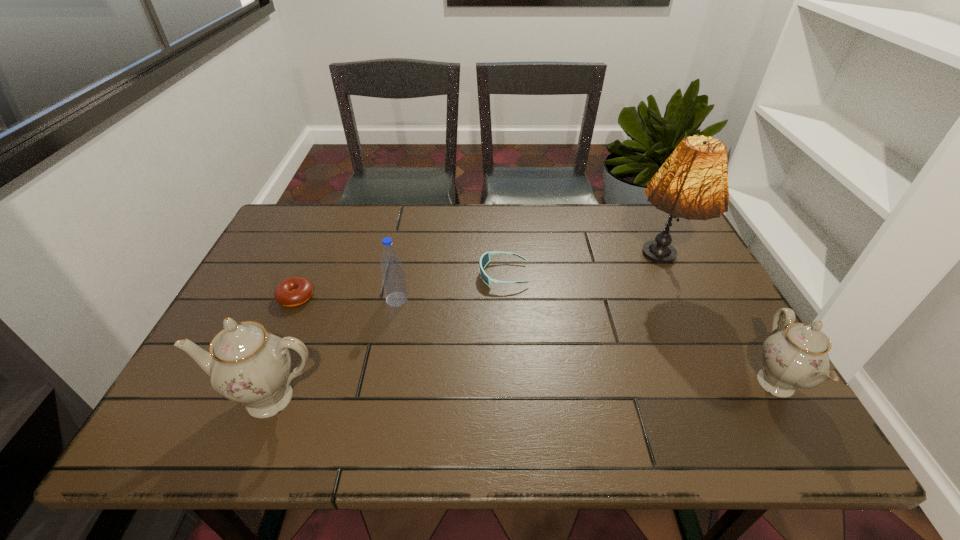
To make them evenly spaced by inserting another chinaware among them, please locate a vacant spot for this new chinaware. Please provide its 2D coordinates. Your answer should be formatted as a tuple, i.e. [(x, y)], where the tuple contains the x and y coordinates of a point satisfying the conditions above.

[(526, 391)]